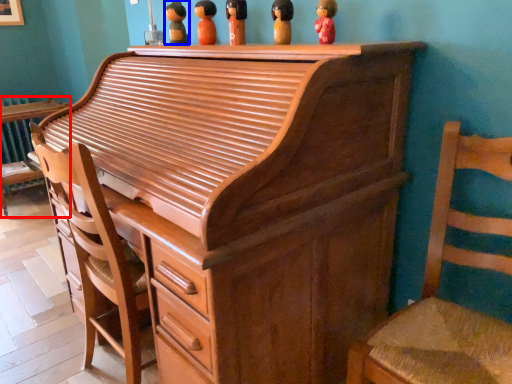
Question: Among these objects, which one is nearest to the camera, furniture (highlighted by a red box) or toy (highlighted by a blue box)?

Choices:
 (A) furniture
 (B) toy

Answer: (B)